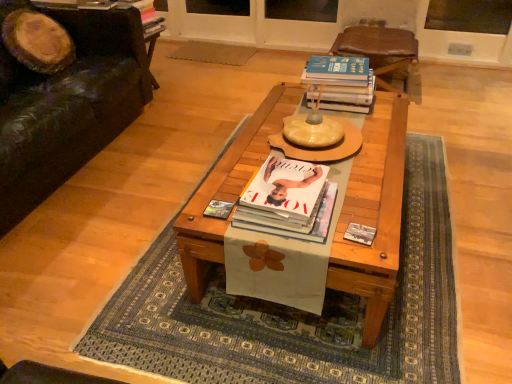
Question: In the image, is matte paper magazine at center on the left side or the right side of white paper with flower design at center?

Choices:
 (A) right
 (B) left

Answer: (B)

Question: Would you say matte paper magazine at center is inside or outside white paper with flower design at center?

Choices:
 (A) inside
 (B) outside

Answer: (B)

Question: Which object is the farthest from the wooden coffee table at center?

Choices:
 (A) white paper with flower design at center
 (B) brown leather chair at upper center
 (C) white glossy book at center, which is counted as the 2th book, starting from the right
 (D) black leather couch at left
 (E) matte paper magazine at center

Answer: (D)

Question: Estimate the real-world distances between objects in this image. Which object is farther from the wooden coffee table at center?

Choices:
 (A) matte yellow round table at center
 (B) brown leather chair at upper center
 (C) hardcover book at upper right, placed as the second book when sorted from left to right
 (D) matte paper magazine at center
 (E) white paper with flower design at center

Answer: (B)